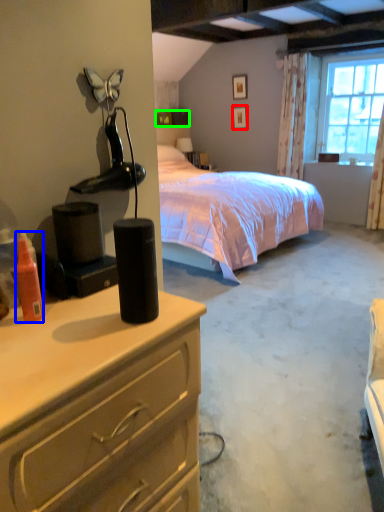
Question: Which object is the farthest from picture frame (highlighted by a red box)? Choose among these: bottle (highlighted by a blue box) or box (highlighted by a green box).

Choices:
 (A) bottle
 (B) box

Answer: (A)